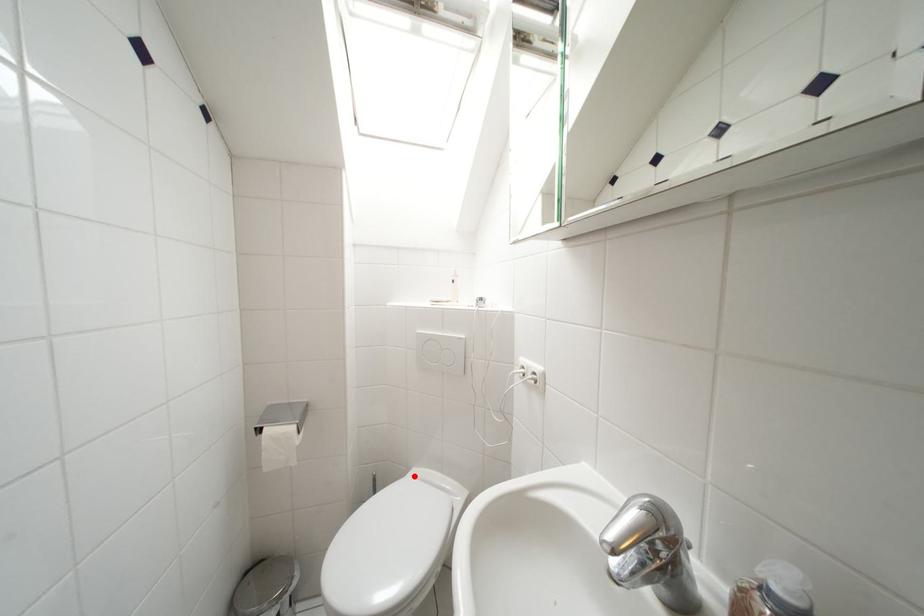
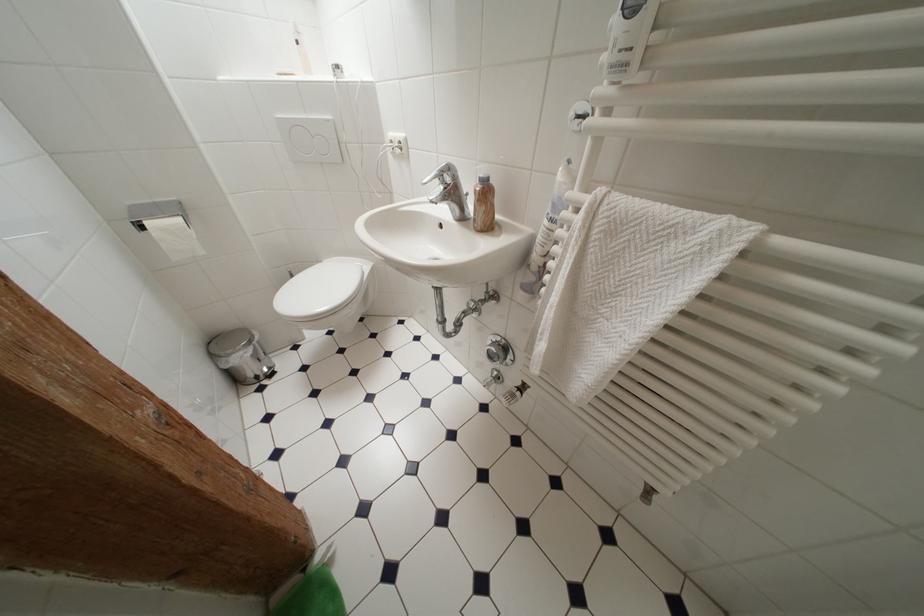
Find the pixel in the second image that matches the highlighted location in the first image.

(325, 265)